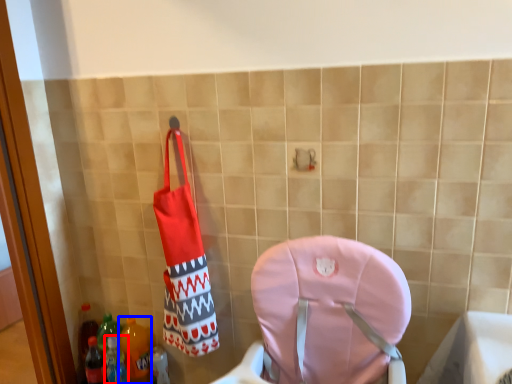
Question: Which point is further to the camera, bottle (highlighted by a red box) or bottle (highlighted by a blue box)?

Choices:
 (A) bottle
 (B) bottle

Answer: (B)